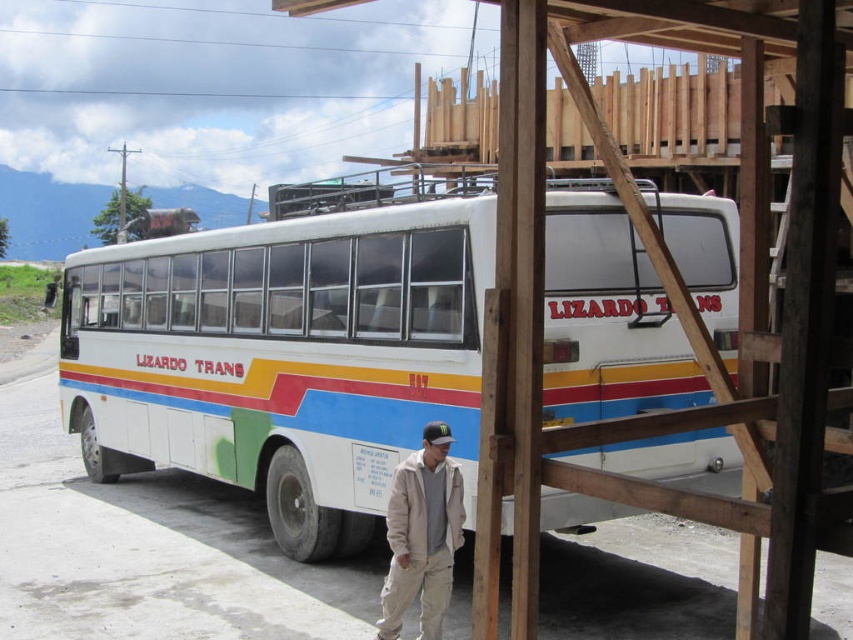
You are a delivery person who needs to park your truck, which is 2 meters wide, in the same spot as the white matte bus at center. Based on the khaki cotton pants at lower center, can you determine if the parking space is wide enough for your truck?

The white matte bus at center is narrower than the khaki cotton pants at lower center, so the parking space might not be wide enough for a 2 meter wide truck. Please check the available space carefully before proceeding.

You are standing at the point marked by coordinates point (285, 355). What object are you closest to?

You are closest to the white matte bus at center, as the point (285, 355) represents its location.

You are a pedestrian standing at the edge of the paved ground. You see the white matte bus at center and the khaki cotton pants at lower center. Which object is positioned higher from the ground?

The white matte bus at center is above khaki cotton pants at lower center, so the white matte bus at center is positioned higher from the ground.